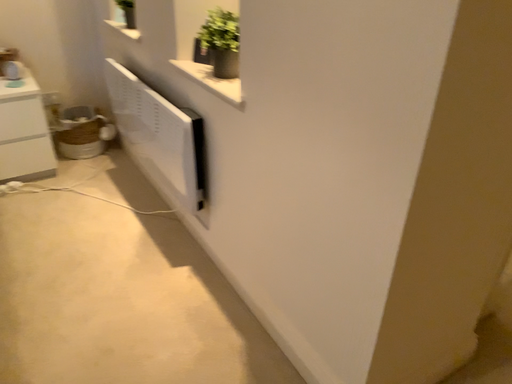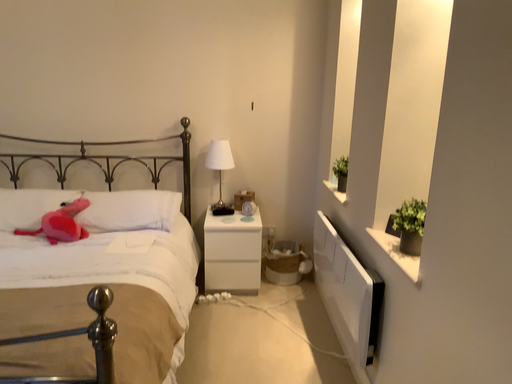
Question: How did the camera likely rotate when shooting the video?

Choices:
 (A) rotated upward
 (B) rotated downward

Answer: (A)